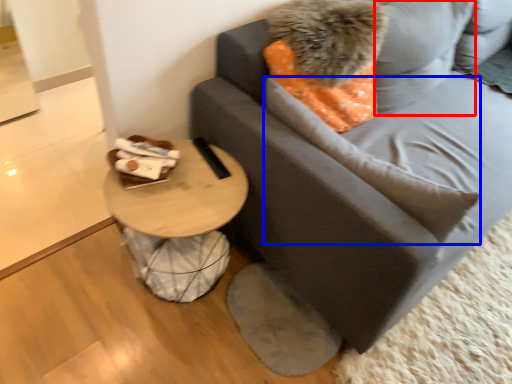
Question: Which of the following is the closest to the observer, pillow (highlighted by a red box) or pillow (highlighted by a blue box)?

Choices:
 (A) pillow
 (B) pillow

Answer: (B)